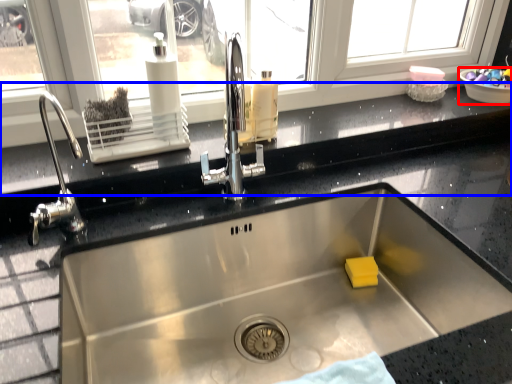
Question: Which point is closer to the camera, basin (highlighted by a red box) or window sill (highlighted by a blue box)?

Choices:
 (A) basin
 (B) window sill

Answer: (B)